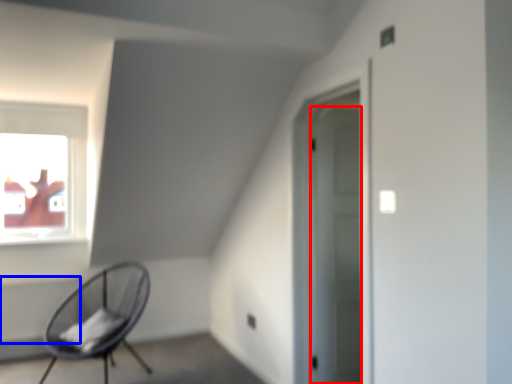
Question: Which of the following is the closest to the observer, door (highlighted by a red box) or radiator (highlighted by a blue box)?

Choices:
 (A) door
 (B) radiator

Answer: (A)